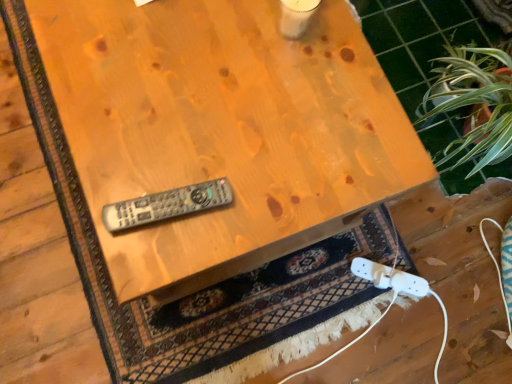
The height and width of the screenshot is (384, 512). I want to click on vacant space in front of white plastic game controller at lower right, so click(x=361, y=308).